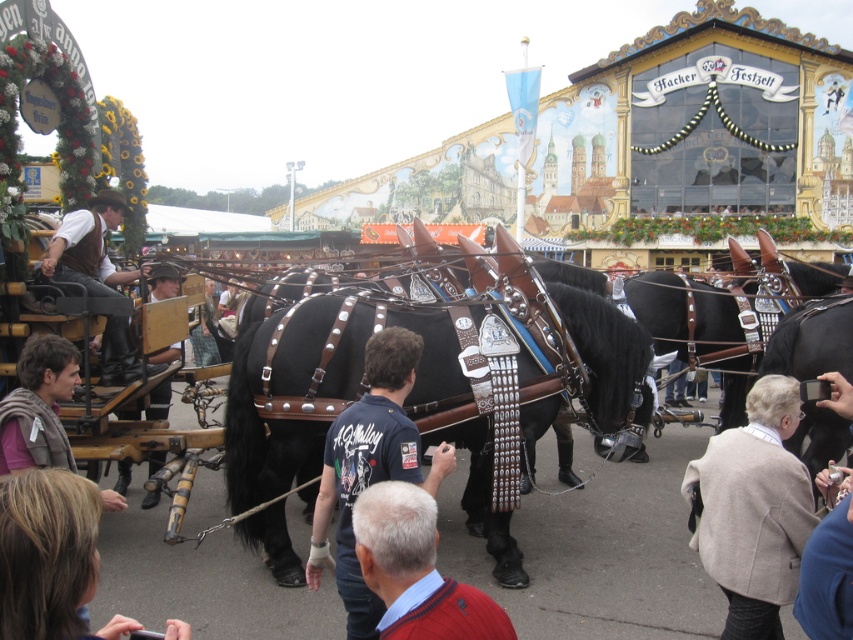
You are a photographer at the festival and want to take a photo of the dark blue shirt at center and the leather hat at center. Which object should you focus on first if you want to capture the taller one in your frame?

The leather hat at center is taller than the dark blue shirt at center, so you should focus on the leather hat at center first to capture the taller one in your frame.

You are a photographer at the festival and need to capture a photo of both the beige wool sweater at lower right and the brown leather jacket at left. Given their positions and sizes, will you need to adjust your camera angle to include both in the frame?

The beige wool sweater at lower right is shorter than the brown leather jacket at left, so you may need to adjust your camera angle to ensure both are fully visible in the frame.

You are a photographer at the festival and want to capture a photo of the dark blue shirt at center and the leather hat at center. Which object is positioned lower in the image?

The dark blue shirt at center is below the leather hat at center, so the dark blue shirt at center is positioned lower in the image.